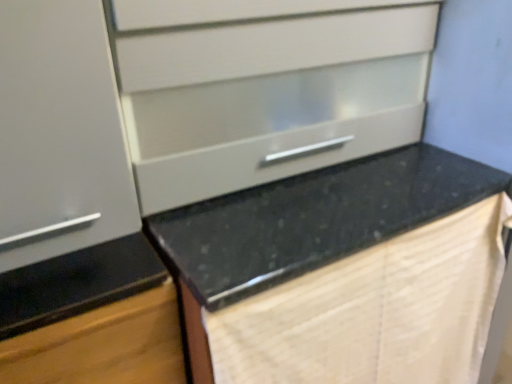
Where is `blank space situated above matte black cabinet at left, which ranks as the 1th cabinetry in bottom-to-top order (from a real-world perspective)`? blank space situated above matte black cabinet at left, which ranks as the 1th cabinetry in bottom-to-top order (from a real-world perspective) is located at coordinates (73, 266).